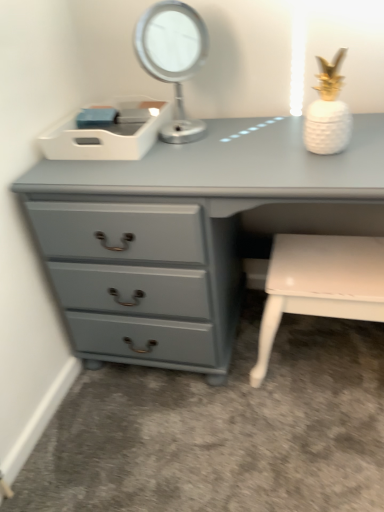
Question: Is the position of matte gray chest of drawers at center more distant than that of white glossy bench at lower right?

Choices:
 (A) no
 (B) yes

Answer: (A)

Question: Are matte gray chest of drawers at center and white glossy bench at lower right making contact?

Choices:
 (A) no
 (B) yes

Answer: (A)

Question: From the image's perspective, is matte gray chest of drawers at center below white glossy bench at lower right?

Choices:
 (A) no
 (B) yes

Answer: (A)

Question: Does matte gray chest of drawers at center have a smaller size compared to white glossy bench at lower right?

Choices:
 (A) no
 (B) yes

Answer: (A)

Question: Can you confirm if matte gray chest of drawers at center is taller than white glossy bench at lower right?

Choices:
 (A) no
 (B) yes

Answer: (B)

Question: From the image's perspective, is white glossy bench at lower right above or below metallic silver table lamp at upper center?

Choices:
 (A) above
 (B) below

Answer: (B)

Question: In terms of size, does white glossy bench at lower right appear bigger or smaller than metallic silver table lamp at upper center?

Choices:
 (A) small
 (B) big

Answer: (B)

Question: Looking at their shapes, would you say white glossy bench at lower right is wider or thinner than metallic silver table lamp at upper center?

Choices:
 (A) thin
 (B) wide

Answer: (B)

Question: Do you think white glossy bench at lower right is within metallic silver table lamp at upper center, or outside of it?

Choices:
 (A) outside
 (B) inside

Answer: (A)

Question: Relative to white glossy bench at lower right, is metallic silver table lamp at upper center in front or behind?

Choices:
 (A) behind
 (B) front

Answer: (B)

Question: Is metallic silver table lamp at upper center taller or shorter than white glossy bench at lower right?

Choices:
 (A) tall
 (B) short

Answer: (B)

Question: Is metallic silver table lamp at upper center inside or outside of white glossy bench at lower right?

Choices:
 (A) outside
 (B) inside

Answer: (A)

Question: From the image's perspective, is metallic silver table lamp at upper center positioned above or below white glossy bench at lower right?

Choices:
 (A) below
 (B) above

Answer: (B)

Question: From their relative heights in the image, would you say matte gray chest of drawers at center is taller or shorter than metallic silver table lamp at upper center?

Choices:
 (A) tall
 (B) short

Answer: (A)

Question: From a real-world perspective, is matte gray chest of drawers at center positioned above or below metallic silver table lamp at upper center?

Choices:
 (A) above
 (B) below

Answer: (B)